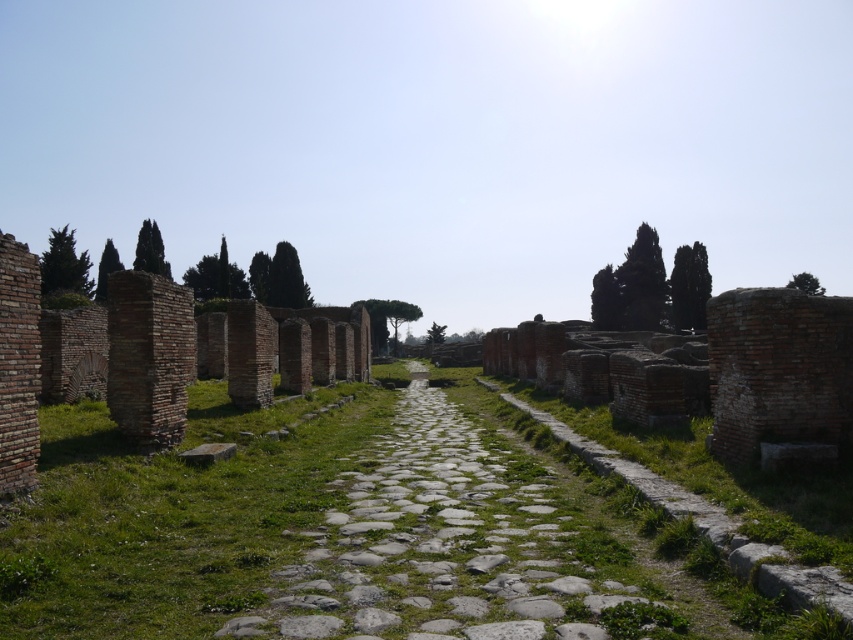
You are a tourist standing at the entrance of the archaeological site. You see the green grass at center and the green leafy cypress at upper left. Which object is closer to the sky?

The green leafy cypress at upper left is closer to the sky because it is positioned above the green grass at center.

You are an archaeologist standing at the edge of the ancient site. You need to walk along the central pathway while avoiding the grassy areas. Based on the scene, can you determine if the gray stone path at center is wide enough to walk on without stepping onto the green grass at center?

The green grass at center might be wider than the gray stone path at center, so there is a possibility that the path is narrower than the grassy area. This means the gray stone path at center may not be wide enough to walk on without stepping onto the green grass at center.